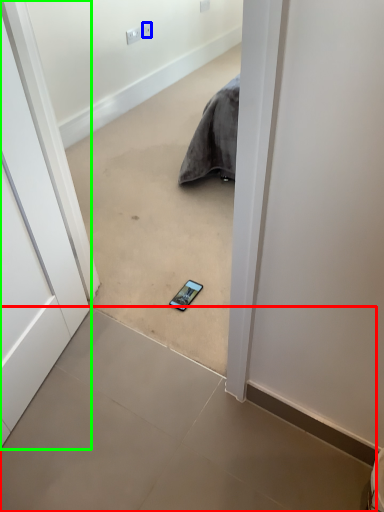
Question: Based on their relative distances, which object is farther from concrete (highlighted by a red box)? Choose from electric outlet (highlighted by a blue box) and door (highlighted by a green box).

Choices:
 (A) electric outlet
 (B) door

Answer: (A)